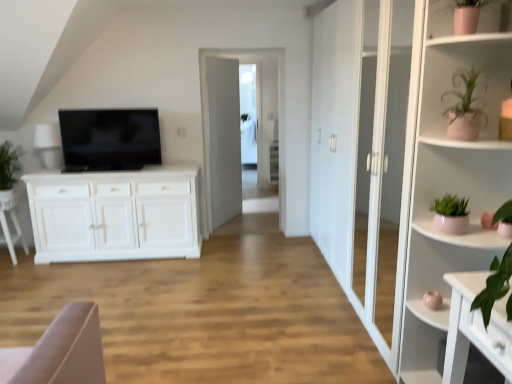
Question: Is pink ceramic plant at upper right next to pink ceramic vase at upper right, the 2th shelf in the bottom-to-top sequence, and touching it?

Choices:
 (A) yes
 (B) no

Answer: (B)

Question: Does pink ceramic plant at upper right have a lesser height compared to pink ceramic vase at upper right, the 2th shelf in the bottom-to-top sequence?

Choices:
 (A) no
 (B) yes

Answer: (A)

Question: Is pink ceramic vase at upper right, the 2th shelf in the bottom-to-top sequence, at the back of pink ceramic plant at upper right?

Choices:
 (A) no
 (B) yes

Answer: (A)

Question: Is pink ceramic plant at upper right wider than pink ceramic vase at upper right, the 2th shelf in the bottom-to-top sequence?

Choices:
 (A) yes
 (B) no

Answer: (A)

Question: Is pink ceramic plant at upper right taller than pink ceramic vase at upper right, the 2th shelf in the bottom-to-top sequence?

Choices:
 (A) no
 (B) yes

Answer: (B)

Question: Is pink ceramic vase at upper right, which is the first shelf in top-to-bottom order, located within pink ceramic plant at upper right?

Choices:
 (A) no
 (B) yes

Answer: (A)

Question: Is pink ceramic plant at right, which is the 2th shelf from top to bottom, turned away from matte black tv at center?

Choices:
 (A) yes
 (B) no

Answer: (B)

Question: Is pink ceramic plant at right, which is the first shelf in bottom-to-top order, not within matte black tv at center?

Choices:
 (A) no
 (B) yes

Answer: (B)

Question: From the image's perspective, would you say pink ceramic plant at right, which is the first shelf in bottom-to-top order, is shown under matte black tv at center?

Choices:
 (A) yes
 (B) no

Answer: (A)

Question: Considering the relative sizes of pink ceramic plant at right, which is the 2th shelf from top to bottom, and matte black tv at center in the image provided, is pink ceramic plant at right, which is the 2th shelf from top to bottom, thinner than matte black tv at center?

Choices:
 (A) no
 (B) yes

Answer: (A)

Question: Is pink ceramic plant at right, which is the 2th shelf from top to bottom, oriented towards matte black tv at center?

Choices:
 (A) yes
 (B) no

Answer: (B)

Question: Is pink ceramic plant at right, which is the first shelf in bottom-to-top order, further to camera compared to matte black tv at center?

Choices:
 (A) yes
 (B) no

Answer: (B)

Question: Would you say pink ceramic plant at right, which is the 2th shelf from top to bottom, is a long distance from pink ceramic vase at upper right, which is the first shelf in top-to-bottom order?

Choices:
 (A) no
 (B) yes

Answer: (A)